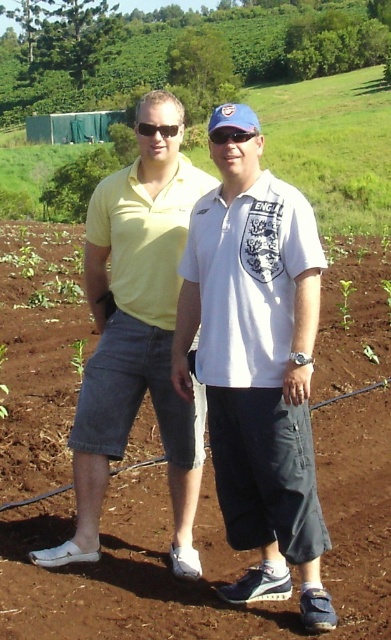
Question: Which object is closer to the camera taking this photo?

Choices:
 (A) sunglasses at center
 (B) white cotton shirt at center

Answer: (B)

Question: Is white cotton shirt at center bigger than sunglasses at center?

Choices:
 (A) yes
 (B) no

Answer: (A)

Question: Is the position of white cotton shirt at center more distant than that of sunglasses at center?

Choices:
 (A) yes
 (B) no

Answer: (B)

Question: From the image, what is the correct spatial relationship of white cotton shirt at center in relation to sunglasses at center?

Choices:
 (A) above
 (B) below

Answer: (B)

Question: Which object appears farthest from the camera in this image?

Choices:
 (A) white cotton shirt at center
 (B) sunglasses at center

Answer: (B)